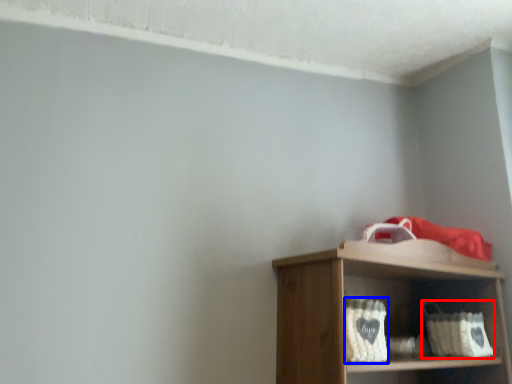
Question: Which object appears farthest to the camera in this image, basket (highlighted by a red box) or basket (highlighted by a blue box)?

Choices:
 (A) basket
 (B) basket

Answer: (A)